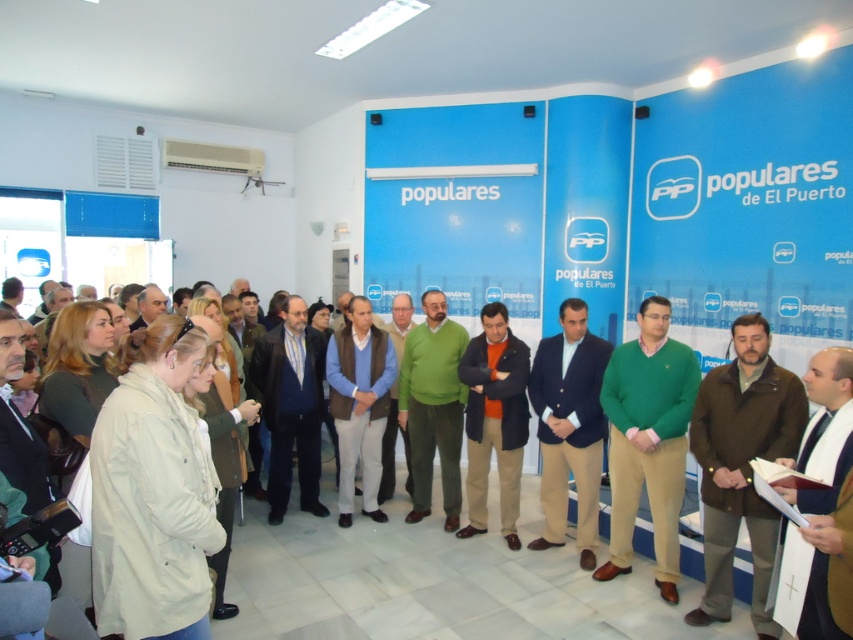
Can you confirm if orange fleece at center is positioned to the left of matte black jacket at center?

In fact, orange fleece at center is to the right of matte black jacket at center.

Between orange fleece at center and matte black jacket at center, which one appears on the right side from the viewer's perspective?

Positioned to the right is orange fleece at center.

This screenshot has width=853, height=640. What are the coordinates of `orange fleece at center` in the screenshot? It's located at tap(494, 419).

Who is taller, brown wool sweater at right or green sweater at center?

With more height is green sweater at center.

Identify the location of brown wool sweater at right. (824, 432).

Is point (850, 376) less distant than point (390, 400)?

That is True.

Locate an element on the screen. brown wool sweater at right is located at coordinates (824, 432).

Does dark gray suit at center appear over light blue sweater at center?

Yes.

Does dark gray suit at center have a lesser width compared to light blue sweater at center?

No, dark gray suit at center is not thinner than light blue sweater at center.

Is point (282, 413) closer to viewer compared to point (337, 342)?

Yes.

This screenshot has width=853, height=640. Identify the location of dark gray suit at center. (291, 404).